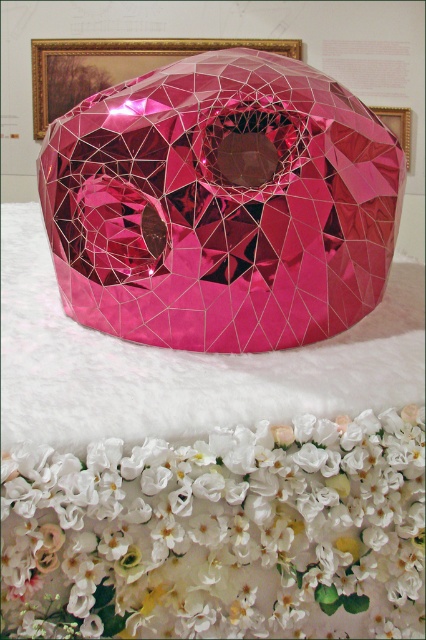
Does shiny pink crystal at center have a larger size compared to white silk flowers at center?

Yes, shiny pink crystal at center is bigger than white silk flowers at center.

Between point (284, 276) and point (339, 497), which one is positioned in front?

Positioned in front is point (339, 497).

Where is `shiny pink crystal at center`? This screenshot has height=640, width=426. shiny pink crystal at center is located at coordinates (221, 205).